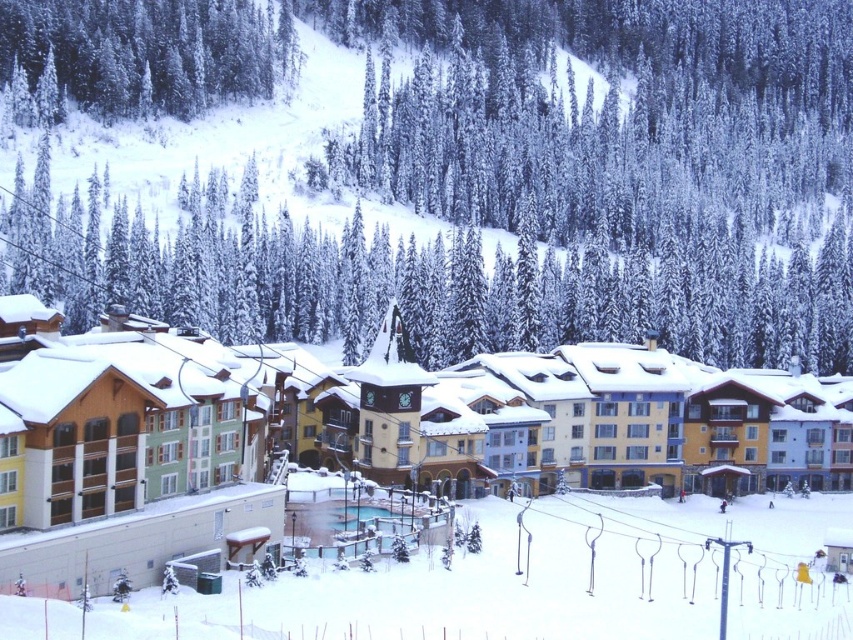
Is point (426, 67) farther from camera compared to point (204, 28)?

Yes, point (426, 67) is farther from viewer.

Can you confirm if snow-covered pine trees at center is shorter than snow-covered evergreen at upper left?

In fact, snow-covered pine trees at center may be taller than snow-covered evergreen at upper left.

Where is `snow-covered pine trees at center`? Image resolution: width=853 pixels, height=640 pixels. snow-covered pine trees at center is located at coordinates click(x=466, y=172).

The height and width of the screenshot is (640, 853). Identify the location of snow-covered pine trees at center. (466, 172).

Between snow-covered pine trees at center and wooden ski resort at center, which one is positioned higher?

Positioned higher is snow-covered pine trees at center.

Does point (846, 184) lie in front of point (555, 458)?

No, (846, 184) is further to viewer.

Which is in front, point (670, 342) or point (67, 532)?

Point (67, 532) is more forward.

The image size is (853, 640). Find the location of `snow-covered pine trees at center`. snow-covered pine trees at center is located at coordinates (466, 172).

Does point (722, 406) lie in front of point (183, 112)?

That is True.

Locate an element on the screen. The height and width of the screenshot is (640, 853). wooden ski resort at center is located at coordinates (358, 436).